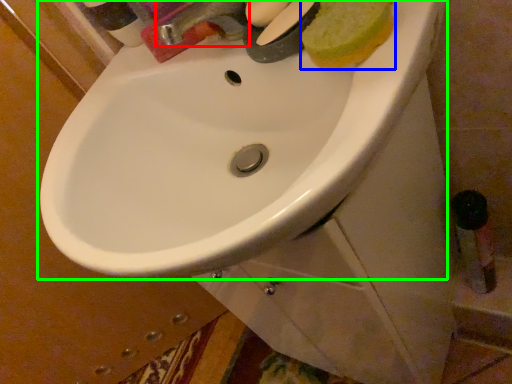
Question: Estimate the real-world distances between objects in this image. Which object is farther from tap (highlighted by a red box), food (highlighted by a blue box) or sink (highlighted by a green box)?

Choices:
 (A) food
 (B) sink

Answer: (B)